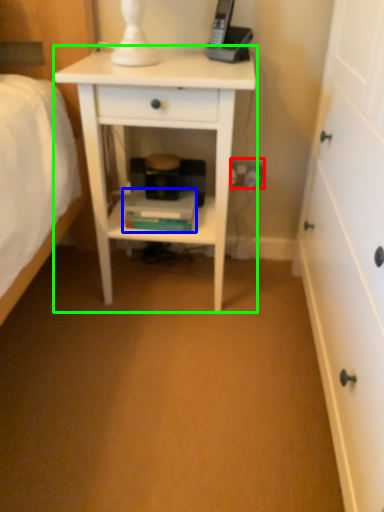
Question: Based on their relative distances, which object is nearer to electric outlet (highlighted by a red box)? Choose from book (highlighted by a blue box) and nightstand (highlighted by a green box).

Choices:
 (A) book
 (B) nightstand

Answer: (A)